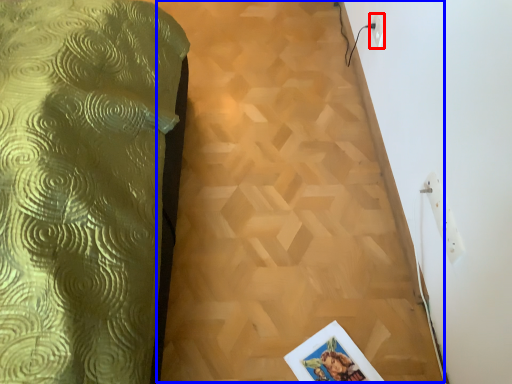
Question: Which of the following is the closest to the observer, electric outlet (highlighted by a red box) or plywood (highlighted by a blue box)?

Choices:
 (A) electric outlet
 (B) plywood

Answer: (B)